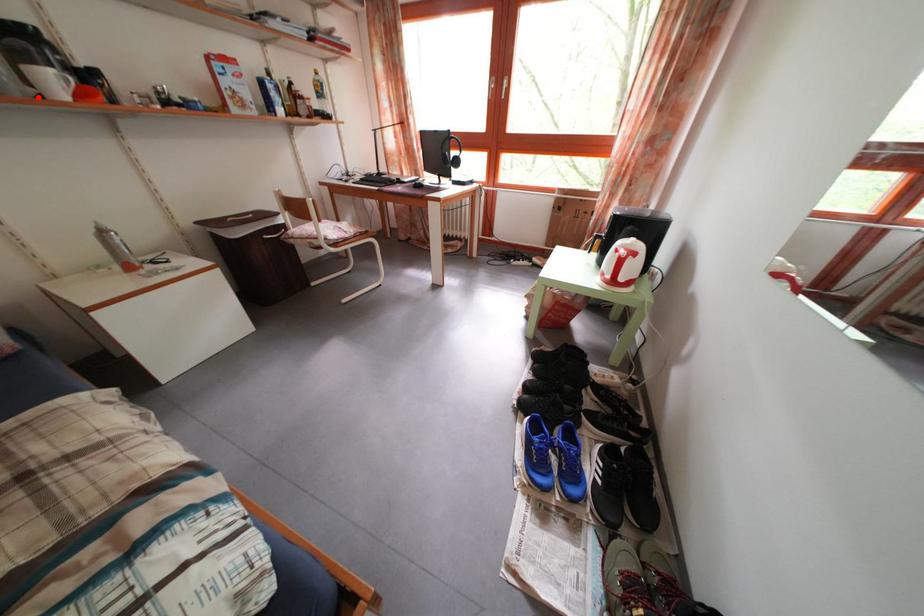
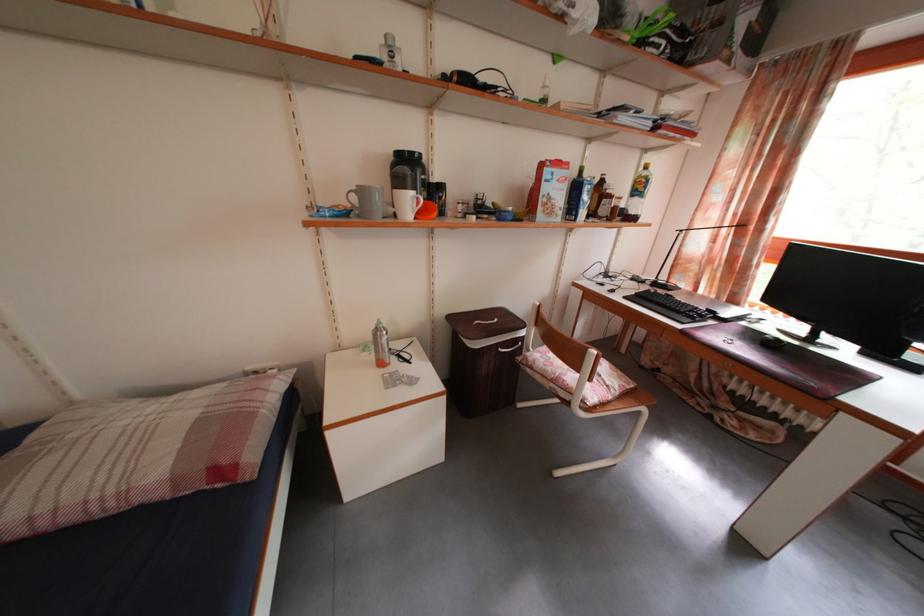
The point at the highlighted location is marked in the first image. Where is the corresponding point in the second image?

(398, 217)